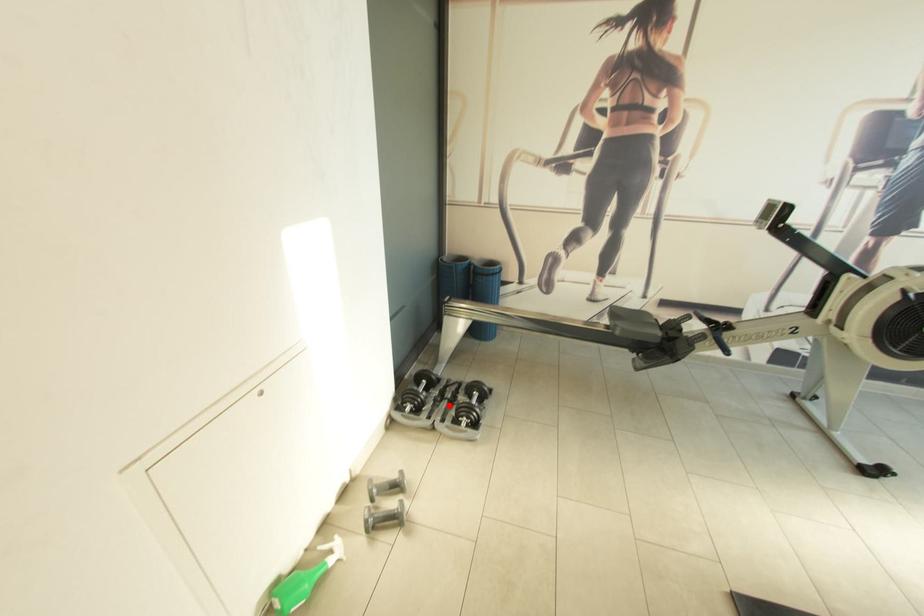
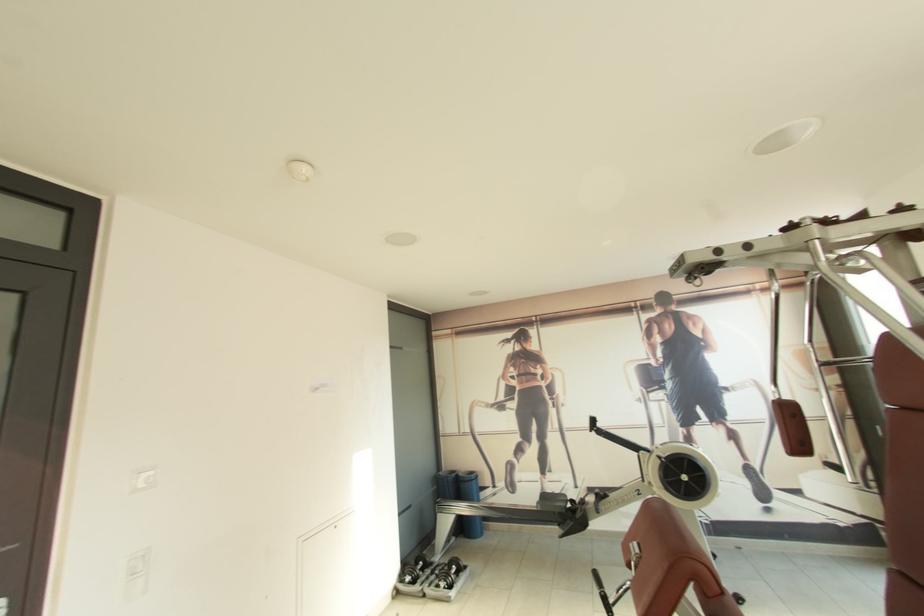
The point at the highlighted location is marked in the first image. Where is the corresponding point in the second image?

(436, 578)